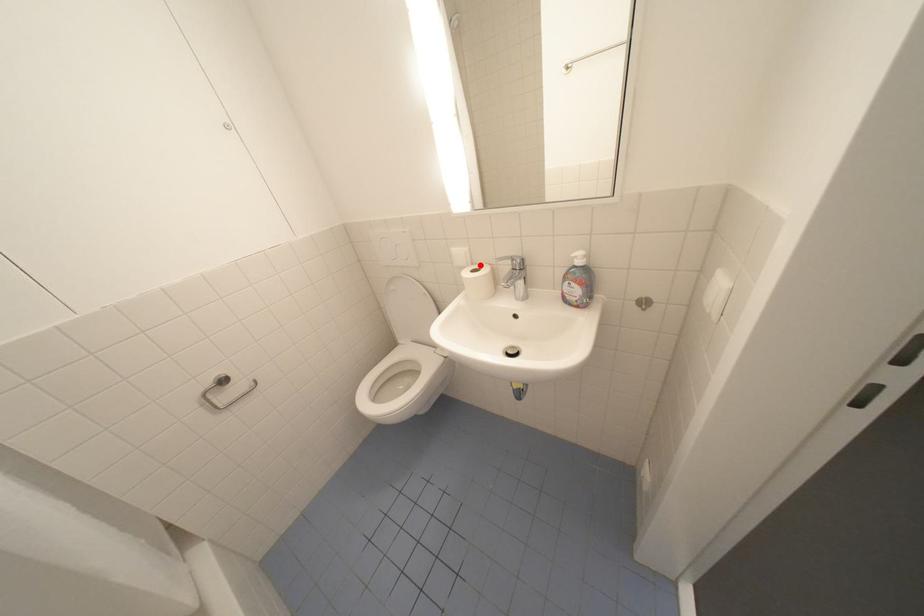
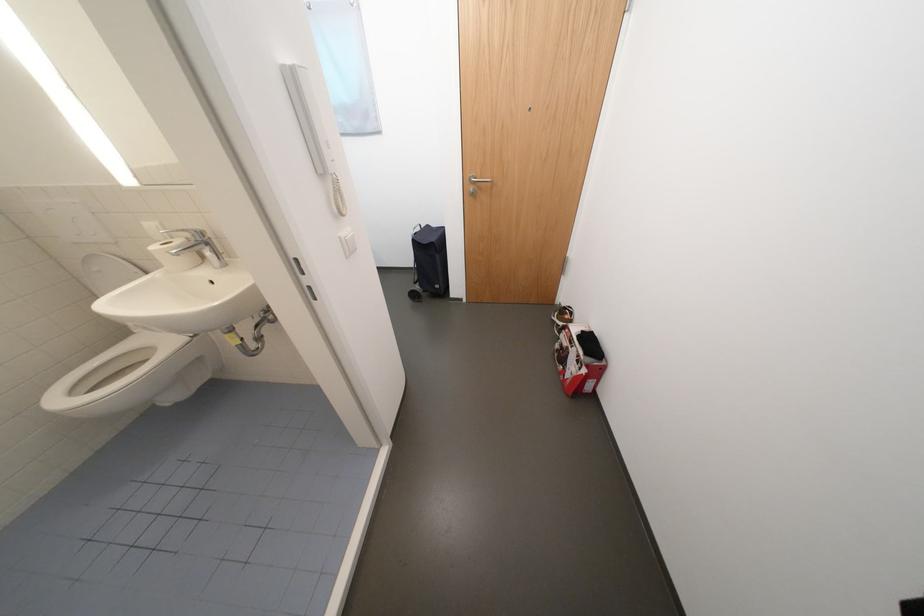
Locate, in the second image, the point that corresponds to the highlighted location in the first image.

(179, 238)